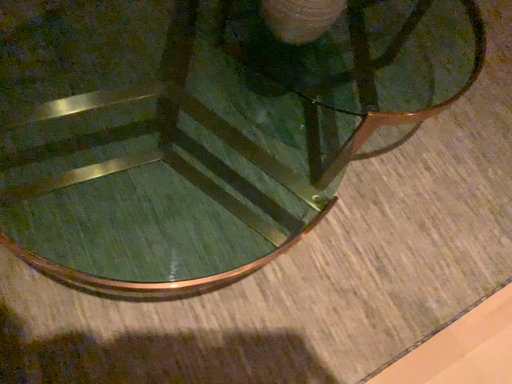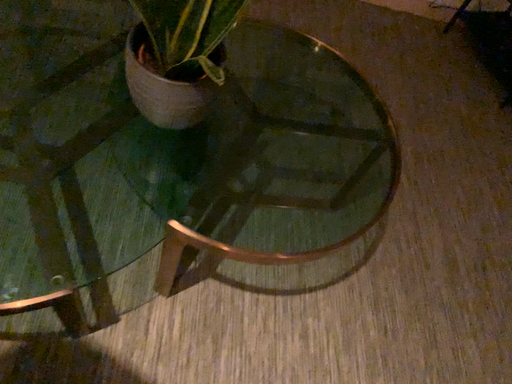
Question: How did the camera likely rotate when shooting the video?

Choices:
 (A) rotated upward
 (B) rotated downward

Answer: (A)